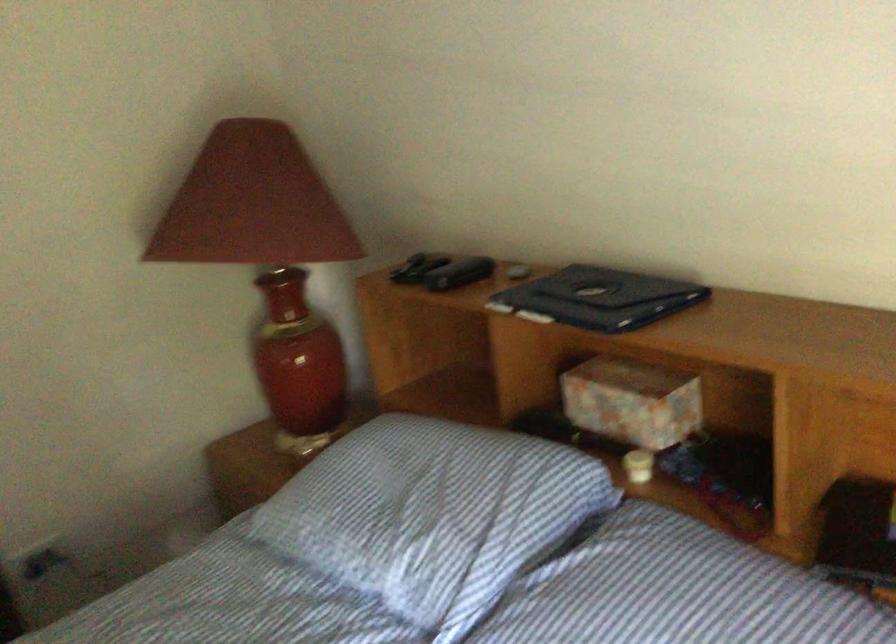
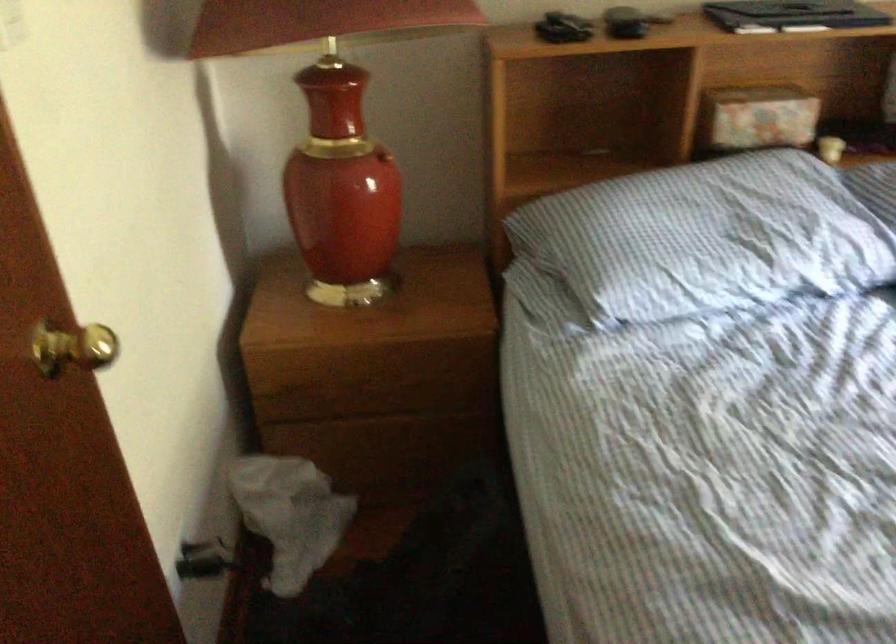
Locate, in the second image, the point that corresponds to (x=615, y=466) in the first image.

(830, 149)